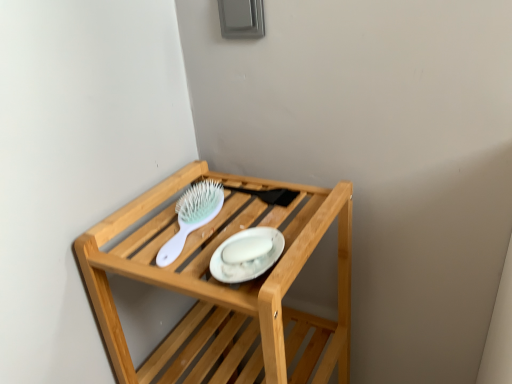
At what (x,y) coordinates should I click in order to perform the action: click on spots to the right of white plastic brush at upper center. Please return your answer as a coordinate pair (x, y). The height and width of the screenshot is (384, 512). Looking at the image, I should click on [x=270, y=211].